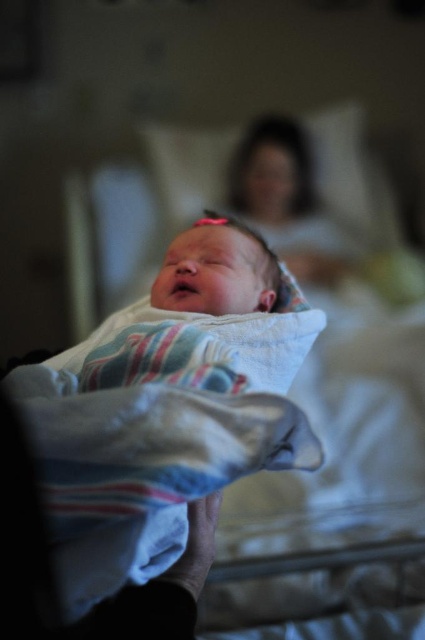
You are a nurse in a hospital. You need to check the vital signs of the mother lying on the bed. The vital signs monitor is located at point coordinates of (x=286, y=200). Where exactly is the monitor located in relation to the mother?

The vital signs monitor is located at point coordinates of (x=286, y=200), which marks the smooth skin mother at upper center. Therefore, the monitor is positioned at the upper center of the mother.

You are a nurse in a hospital room. You need to check the baby wrapped in the striped blanket. To reach the baby, you must first move around either the smooth skin mother at upper center or the white soft blanket at center. Which object should you move around to access the baby?

You should move around the smooth skin mother at upper center because the white soft blanket at center is behind the smooth skin mother at upper center, so moving around the mother would provide access to the baby.